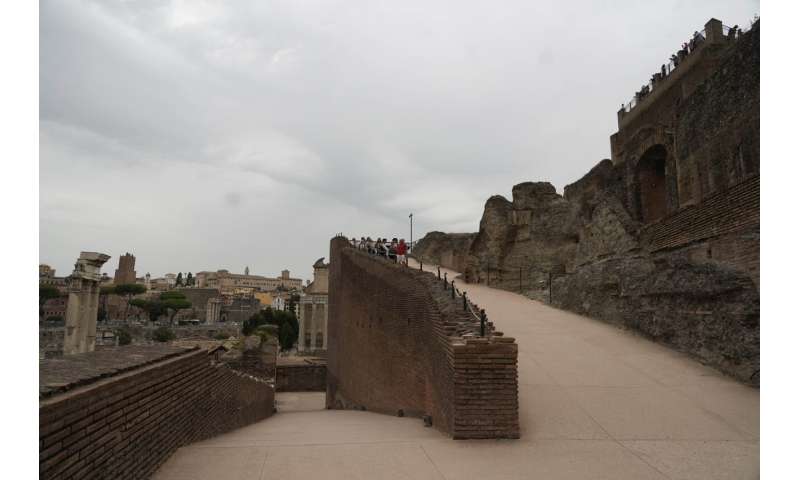
Identify the location of chimney. (282, 276), (246, 269), (716, 24).